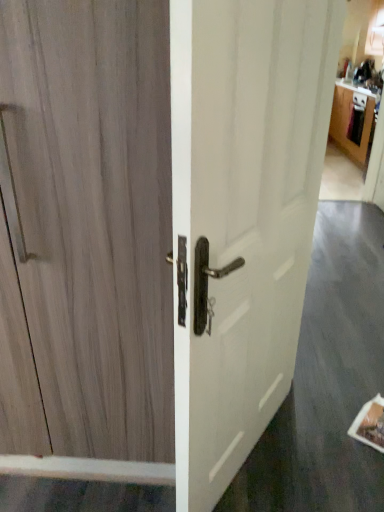
Question: Is light brown wood door at left thinner than wooden cabinet at upper right?

Choices:
 (A) yes
 (B) no

Answer: (A)

Question: Is light brown wood door at left positioned before wooden cabinet at upper right?

Choices:
 (A) yes
 (B) no

Answer: (A)

Question: Are light brown wood door at left and wooden cabinet at upper right far apart?

Choices:
 (A) yes
 (B) no

Answer: (A)

Question: Would you say light brown wood door at left contains wooden cabinet at upper right?

Choices:
 (A) no
 (B) yes

Answer: (A)

Question: Is light brown wood door at left facing towards wooden cabinet at upper right?

Choices:
 (A) no
 (B) yes

Answer: (A)

Question: Is point (339, 97) closer or farther from the camera than point (119, 369)?

Choices:
 (A) farther
 (B) closer

Answer: (A)

Question: Is wooden cabinet at upper right to the left or to the right of light brown wood door at left in the image?

Choices:
 (A) left
 (B) right

Answer: (B)

Question: Is wooden cabinet at upper right wider or thinner than light brown wood door at left?

Choices:
 (A) thin
 (B) wide

Answer: (B)

Question: Based on their sizes in the image, would you say wooden cabinet at upper right is bigger or smaller than light brown wood door at left?

Choices:
 (A) small
 (B) big

Answer: (B)

Question: From the image's perspective, is light brown wood door at left above or below white glossy door handle at center?

Choices:
 (A) below
 (B) above

Answer: (A)

Question: From a real-world perspective, is light brown wood door at left physically located above or below white glossy door handle at center?

Choices:
 (A) above
 (B) below

Answer: (A)

Question: Considering the positions of light brown wood door at left and white glossy door handle at center in the image, is light brown wood door at left taller or shorter than white glossy door handle at center?

Choices:
 (A) tall
 (B) short

Answer: (B)

Question: Visually, is light brown wood door at left positioned to the left or to the right of white glossy door handle at center?

Choices:
 (A) left
 (B) right

Answer: (A)

Question: From a real-world perspective, relative to wooden cabinet at upper right, is light brown wood door at left vertically above or below?

Choices:
 (A) above
 (B) below

Answer: (A)

Question: Is light brown wood door at left in front of or behind wooden cabinet at upper right in the image?

Choices:
 (A) front
 (B) behind

Answer: (A)